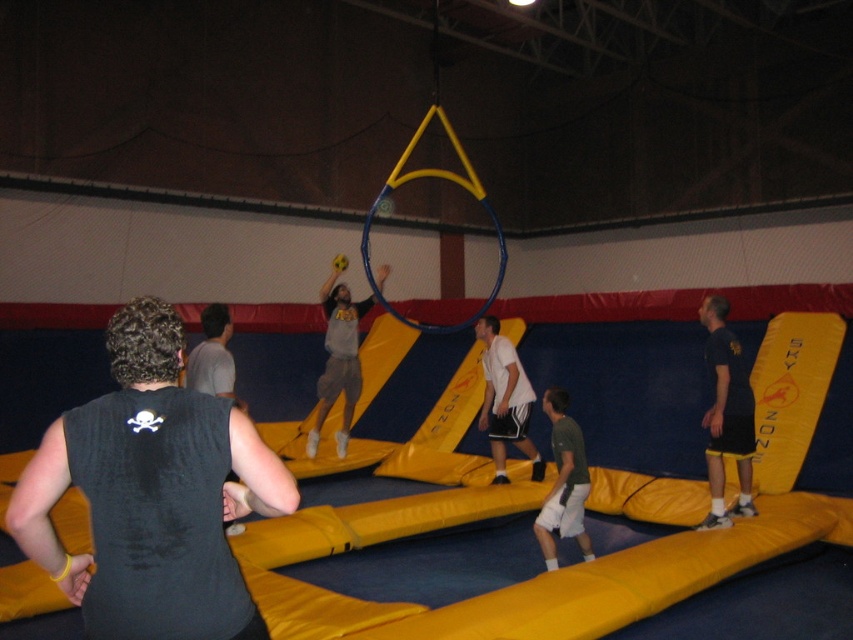
You are a photographer trying to capture a clear photo of the white matte shorts at center and the gray fabric shirt at left. Which object should you focus on first if you want to ensure both are in focus, considering their sizes?

The white matte shorts at center is bigger than the gray fabric shirt at left, so focusing on the larger object first would help ensure both are in focus.

You are standing at the center of the trampoline park and looking towards the yellow padding border. Which direction should you move to find the dark blue shorts at right located at point [726,413]?

The dark blue shorts at right located at point [726,413] are to your right side, so you should move towards the right direction to find them.

You are a visitor at the trampoline park and want to jump towards the two points marked in the image. The first point is at coordinates point (706, 410) and the second point is at point (544, 566). Which point should you aim for if you want to reach the one that is closer to you?

Point (544, 566) is closer to you because it is less further than point (706, 410), which is further away.